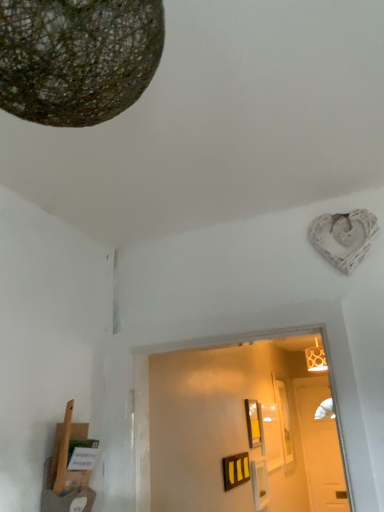
Question: From the image's perspective, is white wooden door at center above matte yellow picture frame at center?

Choices:
 (A) yes
 (B) no

Answer: (B)

Question: Considering the relative sizes of white wooden door at center and matte yellow picture frame at center in the image provided, is white wooden door at center smaller than matte yellow picture frame at center?

Choices:
 (A) yes
 (B) no

Answer: (B)

Question: Is white wooden door at center taller than matte yellow picture frame at center?

Choices:
 (A) no
 (B) yes

Answer: (B)

Question: Does white wooden door at center have a larger size compared to matte yellow picture frame at center?

Choices:
 (A) yes
 (B) no

Answer: (A)

Question: From the image's perspective, is white wooden door at center below matte yellow picture frame at center?

Choices:
 (A) no
 (B) yes

Answer: (B)

Question: Are white wooden door at center and matte yellow picture frame at center making contact?

Choices:
 (A) no
 (B) yes

Answer: (A)

Question: Is textured brown sphere at upper left oriented towards matte yellow picture frame at center?

Choices:
 (A) yes
 (B) no

Answer: (A)

Question: From the image's perspective, does textured brown sphere at upper left appear lower than matte yellow picture frame at center?

Choices:
 (A) no
 (B) yes

Answer: (A)

Question: Is textured brown sphere at upper left closer to camera compared to matte yellow picture frame at center?

Choices:
 (A) no
 (B) yes

Answer: (B)

Question: Is textured brown sphere at upper left in contact with matte yellow picture frame at center?

Choices:
 (A) no
 (B) yes

Answer: (A)

Question: Is textured brown sphere at upper left bigger than matte yellow picture frame at center?

Choices:
 (A) no
 (B) yes

Answer: (B)

Question: From the image's perspective, is textured brown sphere at upper left above matte yellow picture frame at center?

Choices:
 (A) yes
 (B) no

Answer: (A)

Question: Is matte yellow picture frame at center further to camera compared to white wooden door at center?

Choices:
 (A) no
 (B) yes

Answer: (A)